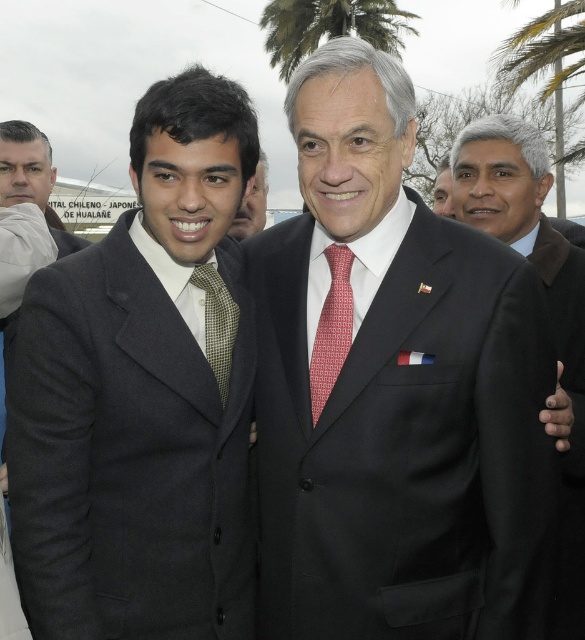
Which is in front, point (576, 308) or point (314, 29)?

Positioned in front is point (576, 308).

Who is higher up, dark gray suit at center or green leafy palm tree at upper center?

green leafy palm tree at upper center is higher up.

Does point (495, 221) come in front of point (326, 8)?

Yes, it is in front of point (326, 8).

The width and height of the screenshot is (585, 640). In order to click on dark gray suit at center in this screenshot , I will do `click(548, 301)`.

Can you confirm if dark gray suit at center is shorter than matte black suit at center?

No.

Does dark gray suit at center have a smaller size compared to matte black suit at center?

Correct, dark gray suit at center occupies less space than matte black suit at center.

What do you see at coordinates (548, 301) in the screenshot? I see `dark gray suit at center` at bounding box center [548, 301].

Where is `dark gray suit at center`? The width and height of the screenshot is (585, 640). dark gray suit at center is located at coordinates (548, 301).

Can you confirm if red woven tie at center is taller than green checkered tie at center?

Yes, red woven tie at center is taller than green checkered tie at center.

Is red woven tie at center thinner than green checkered tie at center?

Yes.

Who is more forward, (325, 397) or (215, 353)?

Point (325, 397) is in front.

Locate an element on the screen. The image size is (585, 640). red woven tie at center is located at coordinates (332, 328).